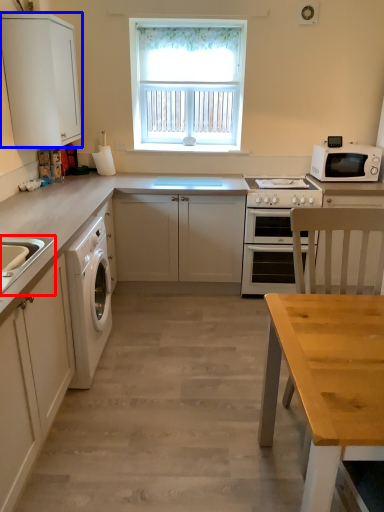
Question: Among these objects, which one is farthest to the camera, sink (highlighted by a red box) or cabinetry (highlighted by a blue box)?

Choices:
 (A) sink
 (B) cabinetry

Answer: (B)